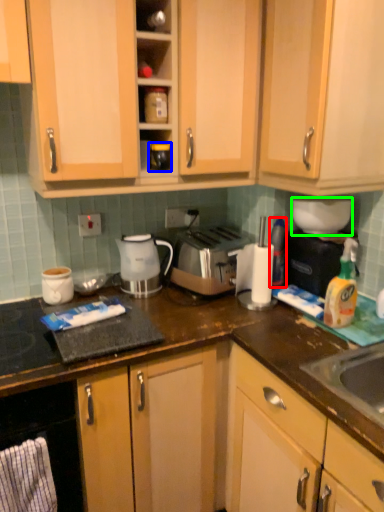
Question: Estimate the real-world distances between objects in this image. Which object is farther from bottle (highlighted by a red box), appliance (highlighted by a blue box) or appliance (highlighted by a green box)?

Choices:
 (A) appliance
 (B) appliance

Answer: (A)